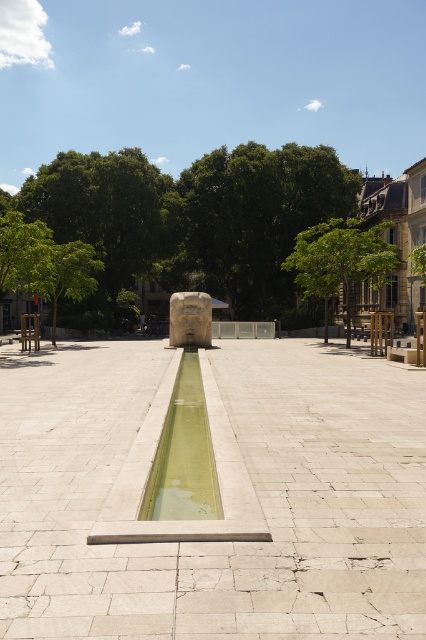
Does green leafy tree at center have a greater width compared to green leafy tree at upper left?

Correct, the width of green leafy tree at center exceeds that of green leafy tree at upper left.

Between point (201, 180) and point (115, 193), which one is positioned behind?

The point (201, 180) is behind.

What do you see at coordinates (259, 212) in the screenshot? This screenshot has width=426, height=640. I see `green leafy tree at center` at bounding box center [259, 212].

You are a GUI agent. You are given a task and a screenshot of the screen. Output one action in this format:
    pyautogui.click(x=<x>, y=<y>)
    Task: Click on the green leafy tree at center
    
    Given the screenshot: What is the action you would take?
    pyautogui.click(x=259, y=212)

Is green leafy tree at upper center shorter than green leafy tree at left?

In fact, green leafy tree at upper center may be taller than green leafy tree at left.

You are a GUI agent. You are given a task and a screenshot of the screen. Output one action in this format:
    pyautogui.click(x=<x>, y=<y>)
    Task: Click on the green leafy tree at upper center
    Image resolution: width=426 pixels, height=640 pixels.
    Given the screenshot: What is the action you would take?
    pyautogui.click(x=192, y=218)

Is green leafy tree at upper center positioned in front of white stone fountain at center?

No, it is not.

Between green leafy tree at upper center and white stone fountain at center, which one is positioned higher?

green leafy tree at upper center is higher up.

Locate an element on the screen. green leafy tree at upper center is located at coordinates (192, 218).